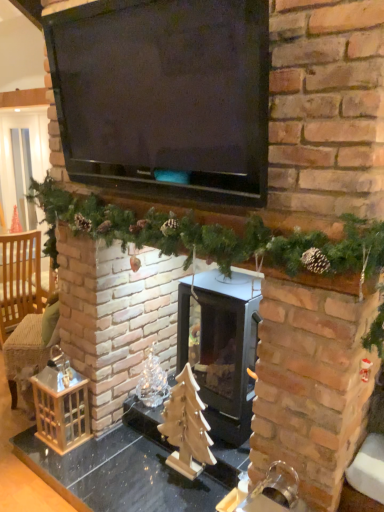
Question: Based on their positions, is green garland at center located to the left or right of wooden table at center?

Choices:
 (A) right
 (B) left

Answer: (A)

Question: Is point (317, 232) positioned closer to the camera than point (69, 466)?

Choices:
 (A) closer
 (B) farther

Answer: (A)

Question: Considering the real-world distances, which object is farthest from the black matte television at upper center?

Choices:
 (A) green garland at center
 (B) wooden christmas tree at center
 (C) black glass wood burning stove at center
 (D) light brown woven armchair at left
 (E) wooden table at center

Answer: (D)

Question: Estimate the real-world distances between objects in this image. Which object is farther from the light brown woven armchair at left?

Choices:
 (A) green garland at center
 (B) black matte television at upper center
 (C) black glass wood burning stove at center
 (D) wooden christmas tree at center
 (E) wooden table at center

Answer: (B)